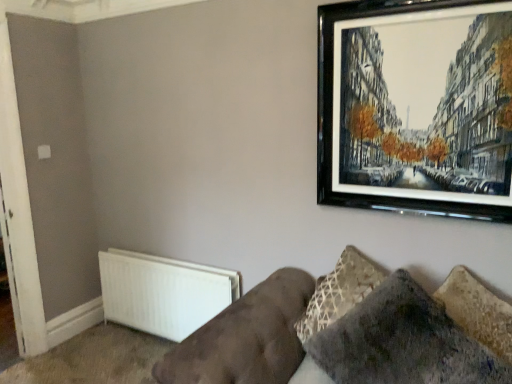
What is the approximate height of velvet brown couch at lower right?

29.12 inches.

In order to face white matte radiator at lower left, should I rotate leftwards or rightwards?

Rotate left and turn 11.886 degrees.

What is the approximate width of velvet gray pillow at lower right?

The width of velvet gray pillow at lower right is 17.77 inches.

Identify the location of velvet brown couch at lower right. (353, 331).

Does velvet gray pillow at lower right have a greater height compared to velvet brown couch at lower right?

Indeed, velvet gray pillow at lower right has a greater height compared to velvet brown couch at lower right.

Which object is closer to the camera taking this photo, velvet gray pillow at lower right or velvet brown couch at lower right?

velvet brown couch at lower right is in front.

Is velvet gray pillow at lower right positioned far away from velvet brown couch at lower right?

They are positioned close to each other.

Considering the sizes of velvet gray pillow at lower right and velvet brown couch at lower right in the image, is velvet gray pillow at lower right bigger or smaller than velvet brown couch at lower right?

Considering their sizes, velvet gray pillow at lower right takes up less space than velvet brown couch at lower right.

Would you say velvet gray pillow at lower right is a long distance from white matte radiator at lower left?

Indeed, velvet gray pillow at lower right is not near white matte radiator at lower left.

Is the position of velvet gray pillow at lower right more distant than that of white matte radiator at lower left?

No, velvet gray pillow at lower right is in front of white matte radiator at lower left.

Considering the relative positions of velvet gray pillow at lower right and white matte radiator at lower left in the image provided, is velvet gray pillow at lower right to the right of white matte radiator at lower left from the viewer's perspective?

Yes, velvet gray pillow at lower right is to the right of white matte radiator at lower left.

Could you tell me if velvet gray pillow at lower right is turned towards white matte radiator at lower left?

No, velvet gray pillow at lower right is not oriented towards white matte radiator at lower left.

Considering the points (441, 369) and (423, 314), which point is behind, point (441, 369) or point (423, 314)?

Positioned behind is point (423, 314).

Based on the photo, from the image's perspective, is velvet brown couch at lower right under velvet gray pillow at lower right?

Yes.

Does velvet brown couch at lower right have a larger size compared to velvet gray pillow at lower right?

Correct, velvet brown couch at lower right is larger in size than velvet gray pillow at lower right.

Is velvet brown couch at lower right wider than velvet gray pillow at lower right?

Correct, the width of velvet brown couch at lower right exceeds that of velvet gray pillow at lower right.

Considering the sizes of objects velvet brown couch at lower right and black glossy picture frame at upper right in the image provided, who is thinner, velvet brown couch at lower right or black glossy picture frame at upper right?

Thinner between the two is black glossy picture frame at upper right.

From a real-world perspective, is velvet brown couch at lower right on top of black glossy picture frame at upper right?

No, from a real-world perspective, velvet brown couch at lower right is not on top of black glossy picture frame at upper right.

Is point (385, 339) farther from camera compared to point (455, 19)?

That is False.

Is velvet brown couch at lower right bigger than white matte door at left?

Indeed, velvet brown couch at lower right has a larger size compared to white matte door at left.

Is velvet brown couch at lower right positioned with its back to white matte door at left?

No.

From a real-world perspective, relative to white matte door at left, is velvet brown couch at lower right vertically above or below?

velvet brown couch at lower right is below white matte door at left.

Looking at this image, how many degrees apart are the facing directions of velvet brown couch at lower right and white matte door at left?

The angle between the facing direction of velvet brown couch at lower right and the facing direction of white matte door at left is 89 degrees.

Can you confirm if black glossy picture frame at upper right is taller than white matte radiator at lower left?

Yes, black glossy picture frame at upper right is taller than white matte radiator at lower left.

From the image's perspective, which one is positioned higher, black glossy picture frame at upper right or white matte radiator at lower left?

black glossy picture frame at upper right appears higher in the image.

Who is smaller, black glossy picture frame at upper right or white matte radiator at lower left?

Smaller between the two is black glossy picture frame at upper right.

Considering the sizes of white matte door at left and black glossy picture frame at upper right in the image, is white matte door at left wider or thinner than black glossy picture frame at upper right?

In the image, white matte door at left appears to be wider than black glossy picture frame at upper right.

Is the depth of white matte door at left greater than that of black glossy picture frame at upper right?

Yes, it is.

What's the angular difference between white matte door at left and black glossy picture frame at upper right's facing directions?

The angular difference between white matte door at left and black glossy picture frame at upper right is 89 degrees.

Is white matte door at left aimed at black glossy picture frame at upper right?

No, white matte door at left is not oriented towards black glossy picture frame at upper right.

This screenshot has width=512, height=384. Identify the location of pillow lying behind the velvet brown couch at lower right. (403, 342).

At what (x,y) coordinates should I click in order to perform the action: click on pillow in front of the white matte radiator at lower left. Please return your answer as a coordinate pair (x, y). This screenshot has height=384, width=512. Looking at the image, I should click on (403, 342).

Considering their positions, is velvet brown couch at lower right positioned closer to white matte radiator at lower left than black glossy picture frame at upper right?

Among the two, velvet brown couch at lower right is located nearer to white matte radiator at lower left.

Looking at the image, which one is located further to white matte door at left, velvet brown couch at lower right or black glossy picture frame at upper right?

black glossy picture frame at upper right is further to white matte door at left.

When comparing their distances from white matte radiator at lower left, does velvet brown couch at lower right or velvet gray pillow at lower right seem closer?

Based on the image, velvet brown couch at lower right appears to be nearer to white matte radiator at lower left.

Looking at the image, which one is located closer to white matte door at left, black glossy picture frame at upper right or velvet brown couch at lower right?

Among the two, velvet brown couch at lower right is located nearer to white matte door at left.

From the image, which object appears to be nearer to black glossy picture frame at upper right, velvet brown couch at lower right or white matte radiator at lower left?

velvet brown couch at lower right is closer to black glossy picture frame at upper right.

Estimate the real-world distances between objects in this image. Which object is further from white matte radiator at lower left, velvet brown couch at lower right or white matte door at left?

velvet brown couch at lower right lies further to white matte radiator at lower left than the other object.

Estimate the real-world distances between objects in this image. Which object is closer to velvet brown couch at lower right, white matte radiator at lower left or velvet gray pillow at lower right?

velvet gray pillow at lower right is closer to velvet brown couch at lower right.

Which object lies further to the anchor point white matte door at left, velvet gray pillow at lower right or velvet brown couch at lower right?

Based on the image, velvet gray pillow at lower right appears to be further to white matte door at left.

The image size is (512, 384). What are the coordinates of `radiator between white matte door at left and velvet gray pillow at lower right from left to right` in the screenshot? It's located at (163, 292).

Identify the location of picture frame between velvet brown couch at lower right and white matte radiator at lower left from front to back. This screenshot has height=384, width=512. (416, 107).

At what (x,y) coordinates should I click in order to perform the action: click on pillow positioned between velvet brown couch at lower right and white matte radiator at lower left from near to far. Please return your answer as a coordinate pair (x, y). Image resolution: width=512 pixels, height=384 pixels. Looking at the image, I should click on (403, 342).

At what (x,y) coordinates should I click in order to perform the action: click on radiator situated between white matte door at left and black glossy picture frame at upper right from left to right. Please return your answer as a coordinate pair (x, y). The image size is (512, 384). Looking at the image, I should click on (163, 292).